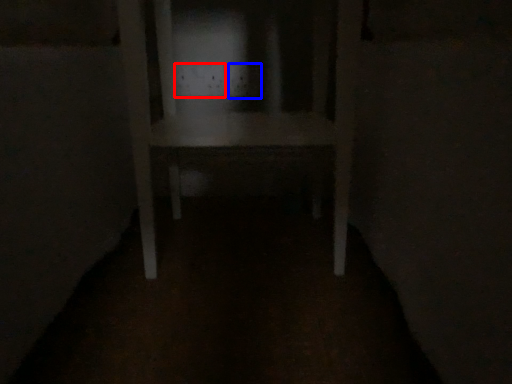
Question: Which object appears farthest to the camera in this image, electric outlet (highlighted by a red box) or electric outlet (highlighted by a blue box)?

Choices:
 (A) electric outlet
 (B) electric outlet

Answer: (A)